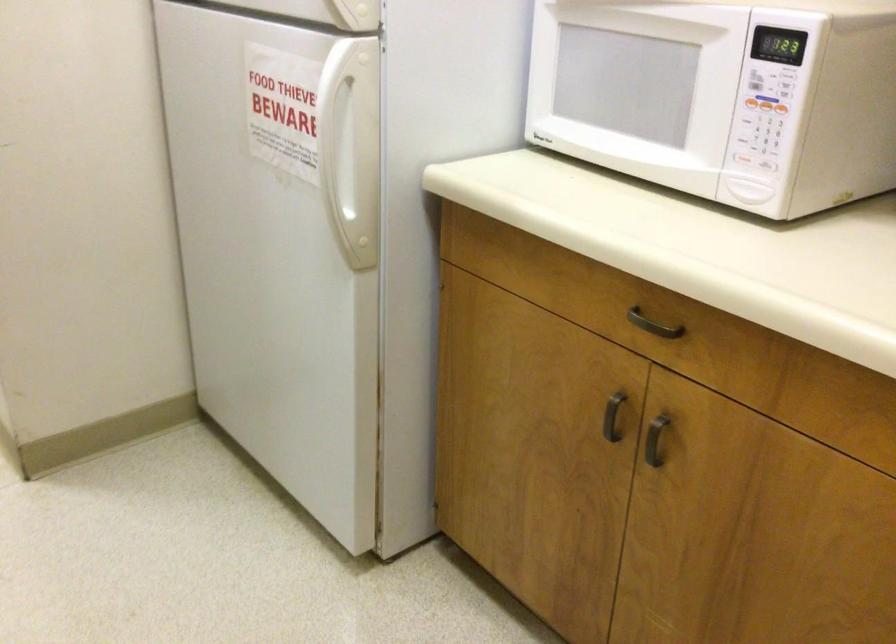
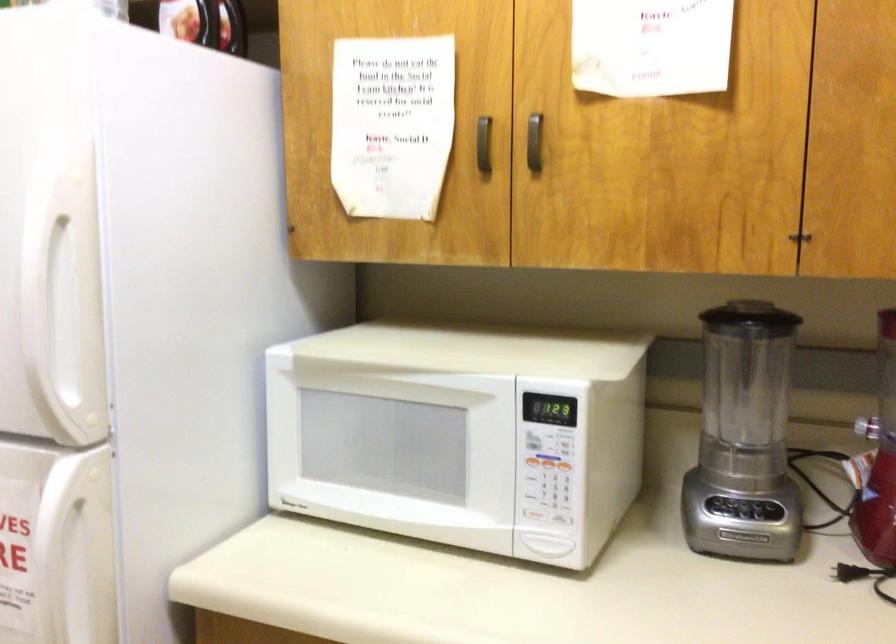
The point at (326, 100) is marked in the first image. Where is the corresponding point in the second image?

(57, 538)